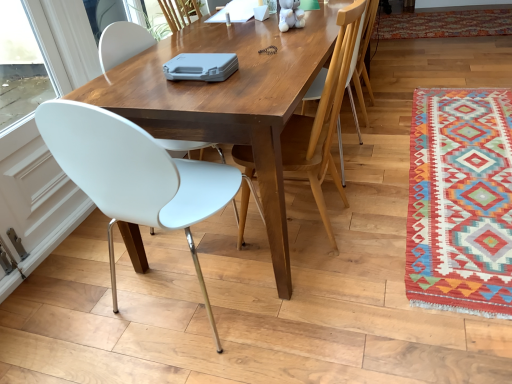
The height and width of the screenshot is (384, 512). I want to click on free point to the right of white plastic chair at center, placed as the 2th chair when sorted from right to left, so click(383, 208).